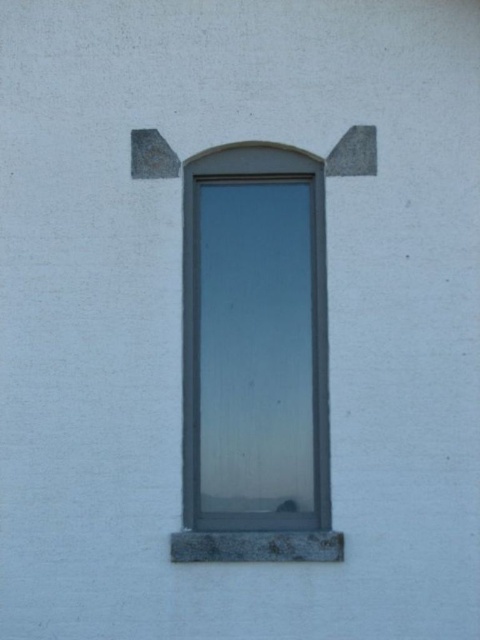
Question: Is gray stone window frame at center positioned behind gray stone window sill at lower center?

Choices:
 (A) no
 (B) yes

Answer: (B)

Question: Among these objects, which one is farthest from the camera?

Choices:
 (A) gray stone window frame at center
 (B) gray stone window sill at lower center

Answer: (A)

Question: Which point is farther to the camera?

Choices:
 (A) gray stone window sill at lower center
 (B) gray stone window frame at center

Answer: (B)

Question: Is gray stone window frame at center smaller than gray stone window sill at lower center?

Choices:
 (A) yes
 (B) no

Answer: (B)

Question: Does gray stone window frame at center appear under gray stone window sill at lower center?

Choices:
 (A) no
 (B) yes

Answer: (A)